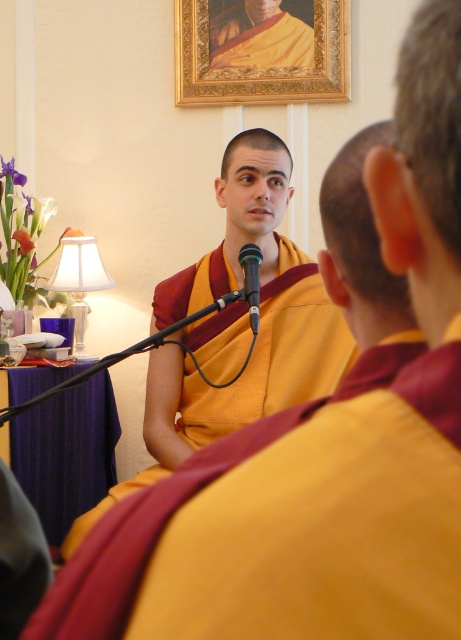
Is white fabric lampshade at left below black plastic microphone at center?

Incorrect, white fabric lampshade at left is not positioned below black plastic microphone at center.

Who is positioned more to the left, white fabric lampshade at left or black plastic microphone at center?

From the viewer's perspective, white fabric lampshade at left appears more on the left side.

The width and height of the screenshot is (461, 640). Describe the element at coordinates (80, 282) in the screenshot. I see `white fabric lampshade at left` at that location.

This screenshot has height=640, width=461. Identify the location of white fabric lampshade at left. (80, 282).

Between yellow silk robe at center and white fabric lampshade at left, which one has more height?

white fabric lampshade at left is taller.

Does yellow silk robe at center have a lesser height compared to white fabric lampshade at left?

Yes.

What do you see at coordinates (260, 36) in the screenshot? The height and width of the screenshot is (640, 461). I see `yellow silk robe at center` at bounding box center [260, 36].

This screenshot has height=640, width=461. I want to click on yellow silk robe at center, so click(260, 36).

Who is taller, matte yellow and maroon robe at center or black plastic microphone at center?

Standing taller between the two is matte yellow and maroon robe at center.

Between matte yellow and maroon robe at center and black plastic microphone at center, which one appears on the right side from the viewer's perspective?

black plastic microphone at center

Which is in front, point (204, 296) or point (260, 262)?

Point (260, 262)

The image size is (461, 640). In order to click on matte yellow and maroon robe at center in this screenshot , I will do `click(273, 355)`.